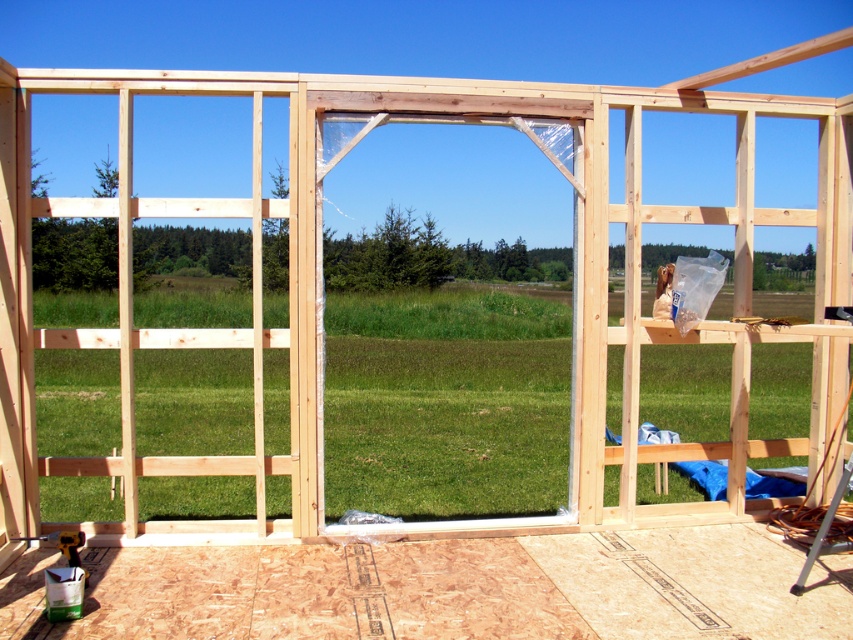
Question: Where is clear plastic window at center located in relation to natural wood screen door at center in the image?

Choices:
 (A) above
 (B) below

Answer: (A)

Question: Is the position of clear plastic window at center more distant than that of natural wood screen door at center?

Choices:
 (A) yes
 (B) no

Answer: (A)

Question: Among these objects, which one is nearest to the camera?

Choices:
 (A) natural wood screen door at center
 (B) clear plastic window at center

Answer: (A)

Question: Among these points, which one is nearest to the camera?

Choices:
 (A) (210, 440)
 (B) (473, 488)

Answer: (B)

Question: Is clear plastic window at center above natural wood screen door at center?

Choices:
 (A) yes
 (B) no

Answer: (A)

Question: Which object appears closest to the camera in this image?

Choices:
 (A) clear plastic window at center
 (B) natural wood screen door at center

Answer: (B)